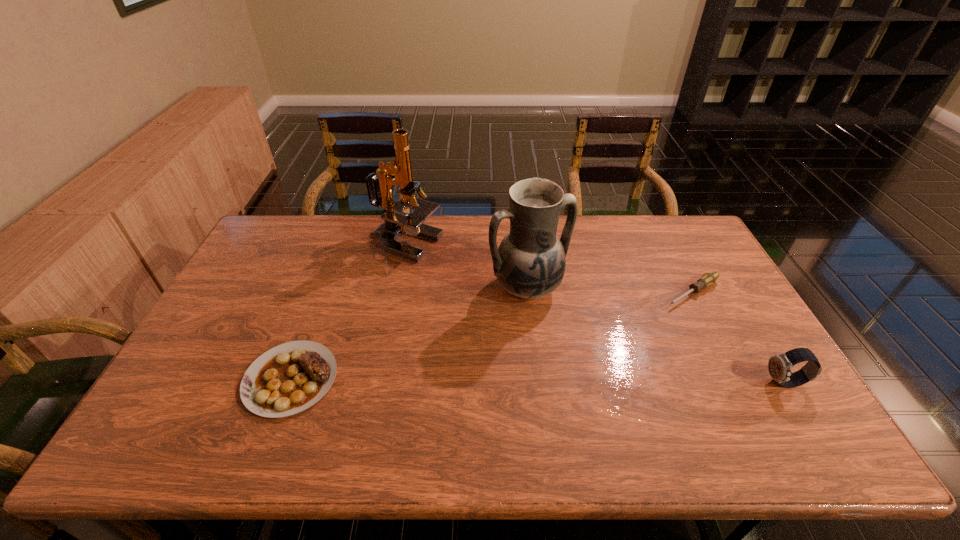
This screenshot has height=540, width=960. In order to click on free space at the far right corner in this screenshot , I will do `click(687, 234)`.

Image resolution: width=960 pixels, height=540 pixels. I want to click on free spot between the second tallest object and the watch, so click(x=656, y=335).

Where is `vacant area that lies between the screwdriver and the steak`? Image resolution: width=960 pixels, height=540 pixels. vacant area that lies between the screwdriver and the steak is located at coordinates click(492, 336).

This screenshot has width=960, height=540. Find the location of `free space between the steak and the screwdriver`. free space between the steak and the screwdriver is located at coordinates (492, 336).

What are the coordinates of `vacant space that's between the watch and the screwdriver` in the screenshot? It's located at (738, 338).

You are a GUI agent. You are given a task and a screenshot of the screen. Output one action in this format:
    pyautogui.click(x=<x>, y=<y>)
    Task: Click on the vacant space that is in between the steak and the screwdriver
    
    Given the screenshot: What is the action you would take?
    tap(492, 336)

Find the location of a particular element. The width and height of the screenshot is (960, 540). free space between the third shortest object and the fourth shortest object is located at coordinates (656, 335).

At what (x,y) coordinates should I click in order to perform the action: click on free spot between the screwdriver and the steak. Please return your answer as a coordinate pair (x, y). The height and width of the screenshot is (540, 960). Looking at the image, I should click on (492, 336).

Locate an element on the screen. This screenshot has width=960, height=540. vacant area that lies between the third shortest object and the screwdriver is located at coordinates pyautogui.click(x=738, y=338).

This screenshot has height=540, width=960. I want to click on vacant region between the screwdriver and the steak, so click(492, 336).